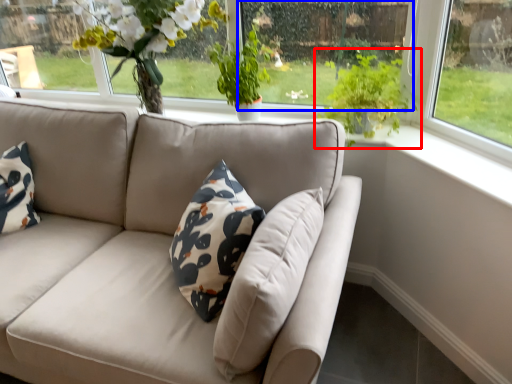
Question: Which point is closer to the camera, houseplant (highlighted by a red box) or window screen (highlighted by a blue box)?

Choices:
 (A) houseplant
 (B) window screen

Answer: (A)